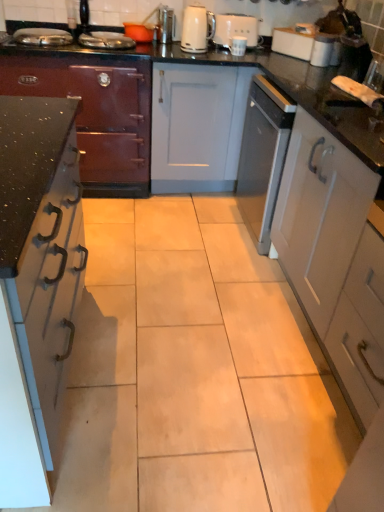
Locate an element on the screen. free space above black speckled countertop at left, the 2th cabinetry in the right-to-left sequence (from a real-world perspective) is located at coordinates (26, 146).